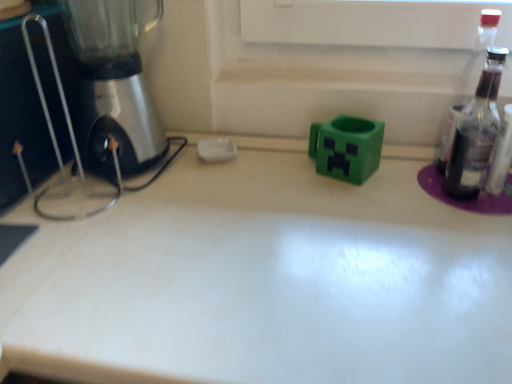
Question: Is the surface of transparent glass bottle at right in direct contact with green matte plastic mug at center?

Choices:
 (A) no
 (B) yes

Answer: (A)

Question: Can you confirm if transparent glass bottle at right is bigger than green matte plastic mug at center?

Choices:
 (A) yes
 (B) no

Answer: (B)

Question: Does transparent glass bottle at right come in front of green matte plastic mug at center?

Choices:
 (A) yes
 (B) no

Answer: (A)

Question: Is transparent glass bottle at right at the right side of green matte plastic mug at center?

Choices:
 (A) no
 (B) yes

Answer: (B)

Question: Is green matte plastic mug at center located within transparent glass bottle at right?

Choices:
 (A) yes
 (B) no

Answer: (B)

Question: Does transparent glass bottle at right come behind green matte plastic mug at center?

Choices:
 (A) yes
 (B) no

Answer: (B)

Question: Is white glossy countertop at center oriented towards metallic silver mixer at left?

Choices:
 (A) yes
 (B) no

Answer: (B)

Question: Considering the relative positions of white glossy countertop at center and metallic silver mixer at left in the image provided, is white glossy countertop at center to the left of metallic silver mixer at left from the viewer's perspective?

Choices:
 (A) no
 (B) yes

Answer: (A)

Question: Does white glossy countertop at center have a lesser height compared to metallic silver mixer at left?

Choices:
 (A) yes
 (B) no

Answer: (B)

Question: From a real-world perspective, is white glossy countertop at center located beneath metallic silver mixer at left?

Choices:
 (A) yes
 (B) no

Answer: (A)

Question: Is white glossy countertop at center positioned behind metallic silver mixer at left?

Choices:
 (A) yes
 (B) no

Answer: (B)

Question: Is white glossy countertop at center surrounding metallic silver mixer at left?

Choices:
 (A) no
 (B) yes

Answer: (A)

Question: Is green matte plastic mug at center in contact with white glossy countertop at center?

Choices:
 (A) yes
 (B) no

Answer: (B)